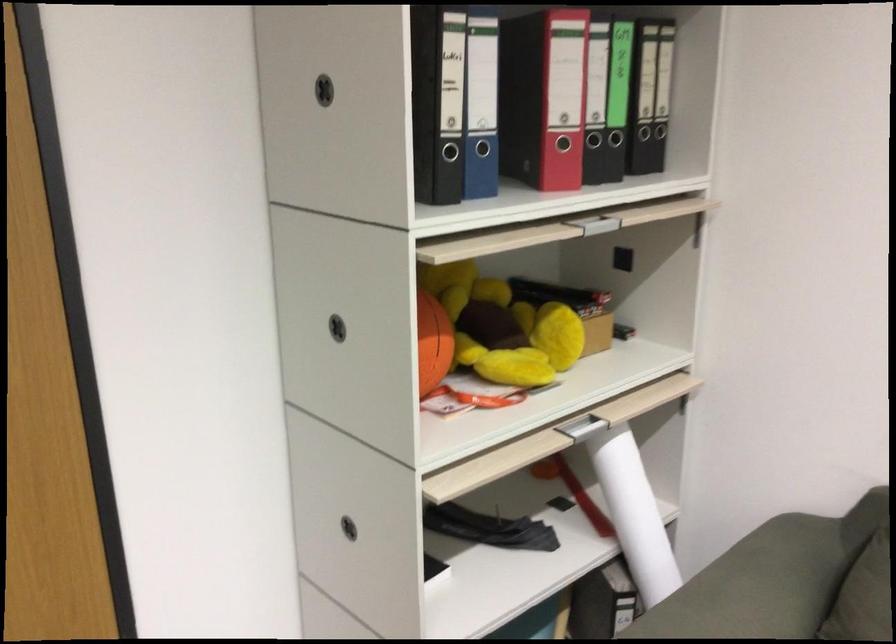
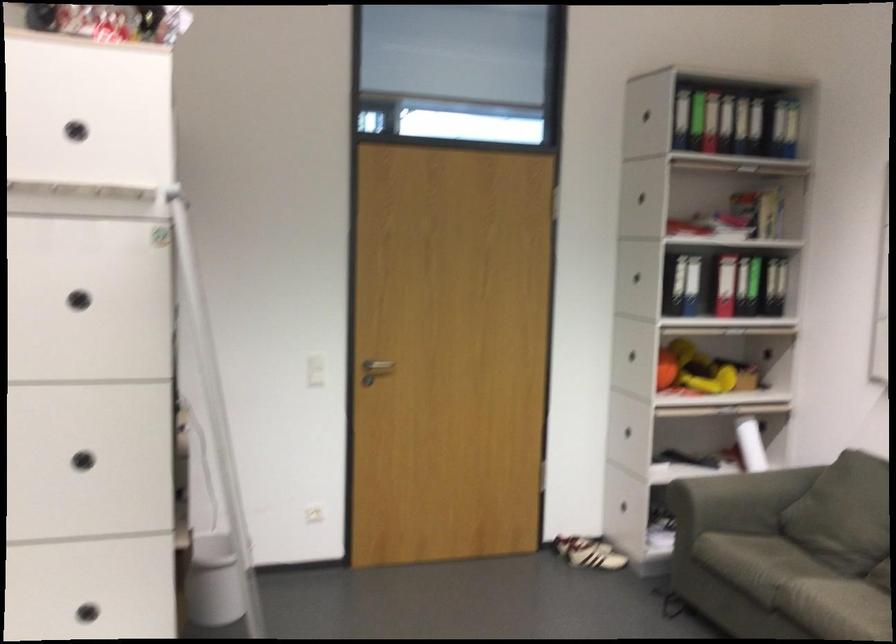
Question: I am providing you with two images of the same scene from different viewpoints. After the viewpoint changes to image2, which objects are now occluded?

Choices:
 (A) rolled white paper
 (B) black binder
 (C) sofa sitting surface
 (D) none of these

Answer: (D)